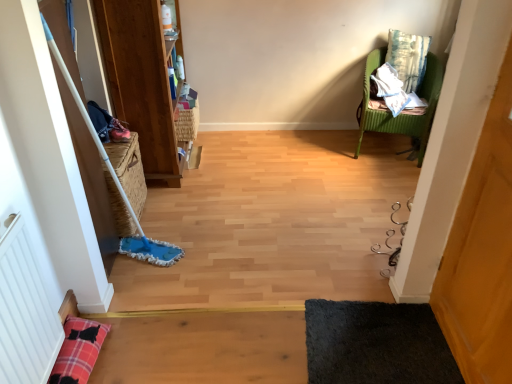
You are a GUI agent. You are given a task and a screenshot of the screen. Output one action in this format:
    pyautogui.click(x=<x>, y=<y>)
    Task: Click on the free spot to the right of wooden bookshelf at left
    
    Given the screenshot: What is the action you would take?
    pyautogui.click(x=236, y=152)